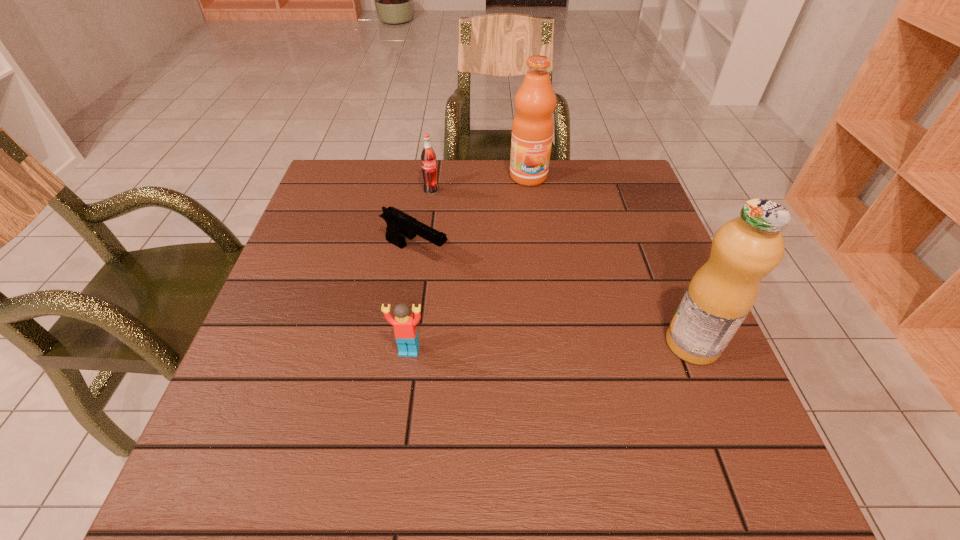
The image size is (960, 540). Identify the location of free space between the third tallest object and the farther fruit juice. (480, 184).

Find the location of `empty space that is in between the farther fruit juice and the rightmost object`. empty space that is in between the farther fruit juice and the rightmost object is located at coordinates (611, 260).

Locate an element on the screen. This screenshot has width=960, height=540. free space that is in between the shortest object and the second shortest object is located at coordinates [412, 302].

Where is `vacant region between the nearer fruit juice and the third nearest object`? vacant region between the nearer fruit juice and the third nearest object is located at coordinates (554, 299).

The height and width of the screenshot is (540, 960). I want to click on vacant region between the nearer fruit juice and the shortest object, so click(x=554, y=299).

You are a GUI agent. You are given a task and a screenshot of the screen. Output one action in this format:
    pyautogui.click(x=<x>, y=<y>)
    Task: Click on the unoccupied position between the second object from right to left and the rightmost object
    
    Given the screenshot: What is the action you would take?
    pyautogui.click(x=611, y=260)

You are a GUI agent. You are given a task and a screenshot of the screen. Output one action in this format:
    pyautogui.click(x=<x>, y=<y>)
    Task: Click on the free point between the Lego and the farther fruit juice
    
    Given the screenshot: What is the action you would take?
    pyautogui.click(x=468, y=264)

The image size is (960, 540). I want to click on free space between the right fruit juice and the left fruit juice, so click(x=611, y=260).

Where is `vacant area that lies between the soda bottle and the nearer fruit juice`? The image size is (960, 540). vacant area that lies between the soda bottle and the nearer fruit juice is located at coordinates (562, 267).

Locate an element on the screen. The height and width of the screenshot is (540, 960). free space between the fourth object from left to right and the right fruit juice is located at coordinates (611, 260).